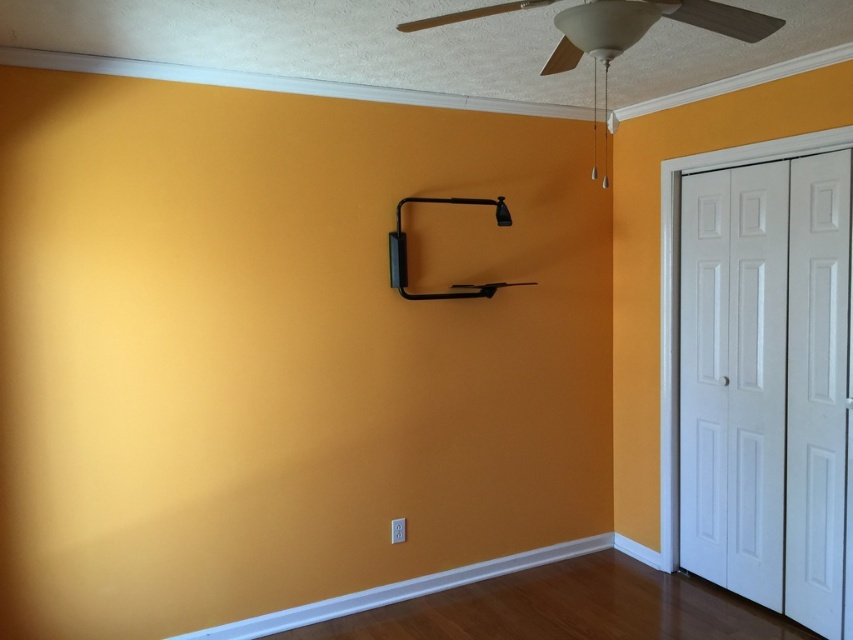
You are standing in the room and want to reach the white matte ceiling fan at upper center to adjust its blades. Considering your height is 5 feet, do you think you can reach it without any tools?

The white matte ceiling fan at upper center is 5.69 feet away from the viewer. Since your height is 5 feet, you cannot reach it without a ladder or other tool.

You are an interior designer planning to install a new wall fixture. You need to ensure it doesn not interfere with the existing white smooth baseboard at lower center. What are the coordinates of the baseboard to avoid?

The white smooth baseboard at lower center is located at coordinates [398,589], so you should avoid placing the new fixture near this point to prevent interference.

You are standing in the room and want to hang a picture frame between the white matte ceiling fan at upper center and the white smooth baseboard at lower center. Which object should you place the frame closer to if you want it to be at the same height as the taller object?

The white matte ceiling fan at upper center is taller than the white smooth baseboard at lower center. Therefore, to place the picture frame at the same height as the taller object, you should position it closer to the white matte ceiling fan at upper center.